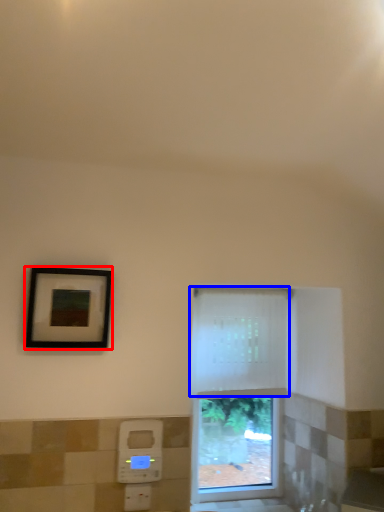
Question: Which object appears farthest to the camera in this image, picture frame (highlighted by a red box) or curtain (highlighted by a blue box)?

Choices:
 (A) picture frame
 (B) curtain

Answer: (B)